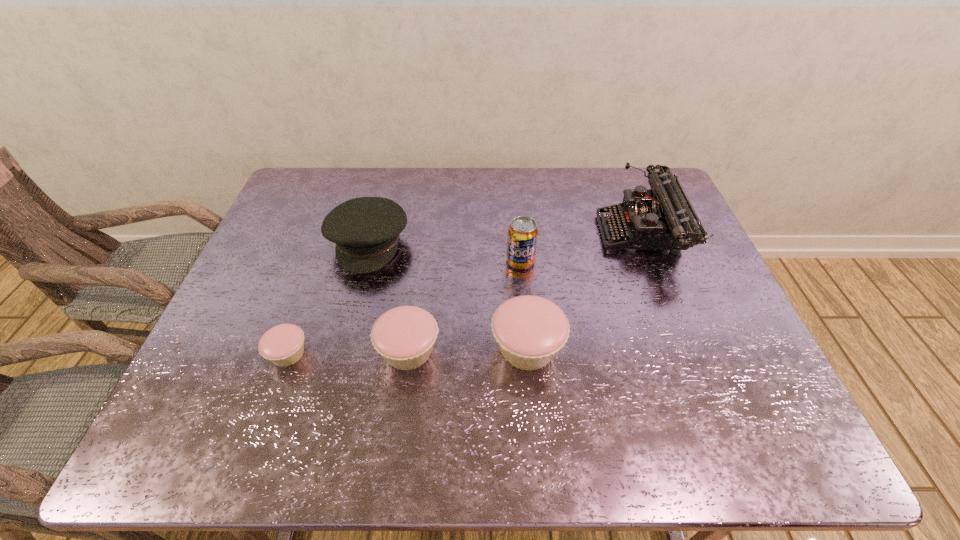
Where is `object located at the far right corner`? object located at the far right corner is located at coordinates (662, 218).

The image size is (960, 540). Find the location of `vacant space at the far edge of the desktop`. vacant space at the far edge of the desktop is located at coordinates (502, 195).

Find the location of a particular element. The image size is (960, 540). vacant space at the near edge of the desktop is located at coordinates (481, 397).

Where is `blank area at the left edge`? blank area at the left edge is located at coordinates pos(287,211).

This screenshot has width=960, height=540. In the image, there is a desktop. Find the location of `vacant space at the right edge`. vacant space at the right edge is located at coordinates (678, 258).

In the image, there is a desktop. Identify the location of vacant space at the near left corner. (260, 379).

Identify the location of free space that is in between the rightmost cupcake and the typewriter. This screenshot has height=540, width=960. (585, 291).

What are the coordinates of `vacant point located between the second shortest object and the leftmost cupcake` in the screenshot? It's located at (348, 352).

The width and height of the screenshot is (960, 540). What are the coordinates of `empty location between the soda can and the second shortest cupcake` in the screenshot? It's located at (465, 306).

Where is `vacant region between the second shortest cupcake and the soda can`? The width and height of the screenshot is (960, 540). vacant region between the second shortest cupcake and the soda can is located at coordinates (465, 306).